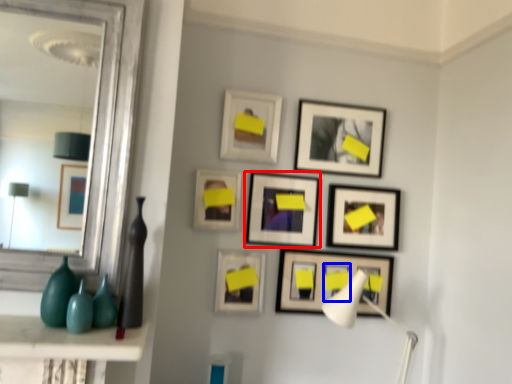
Question: Which object is closer to the camera taking this photo, picture frame (highlighted by a red box) or picture frame (highlighted by a blue box)?

Choices:
 (A) picture frame
 (B) picture frame

Answer: (A)